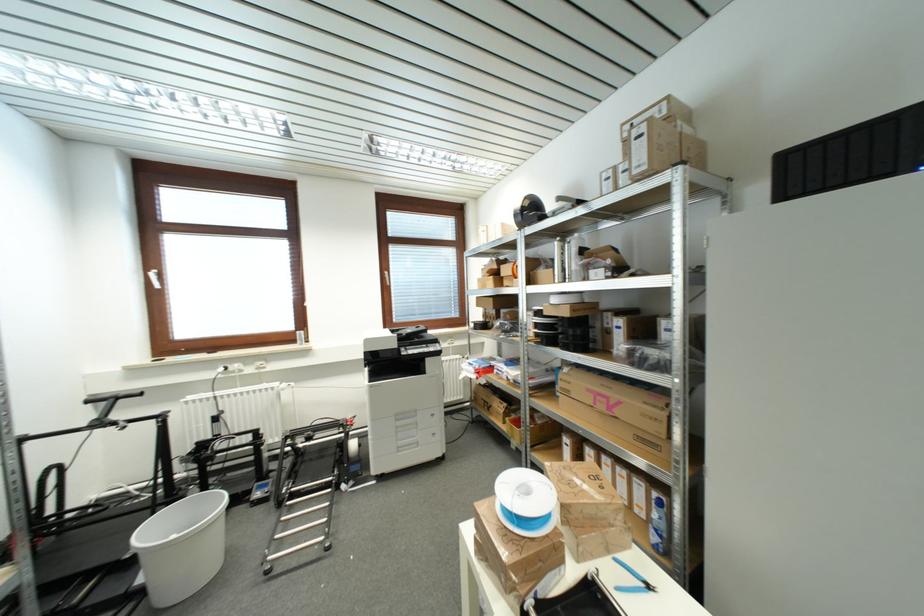
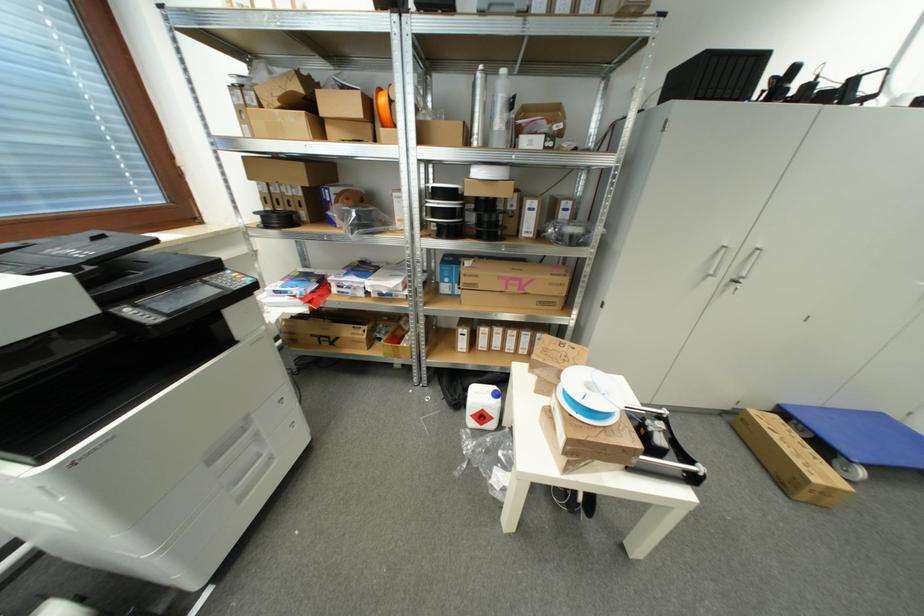
Locate, in the second image, the point that corresponds to point 419,427 in the first image.

(261, 438)